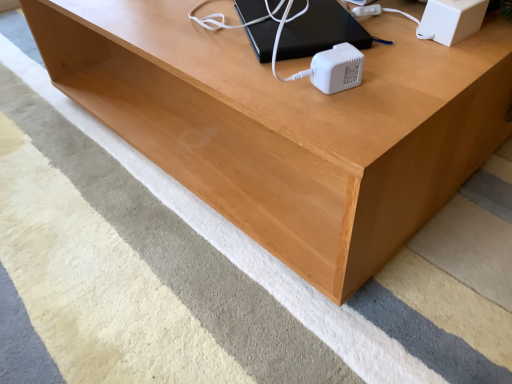
Question: Is black plastic computer at upper center bigger or smaller than white plastic speaker at upper right?

Choices:
 (A) small
 (B) big

Answer: (B)

Question: In terms of height, does black plastic computer at upper center look taller or shorter compared to white plastic speaker at upper right?

Choices:
 (A) tall
 (B) short

Answer: (B)

Question: Relative to white plastic speaker at upper right, is black plastic computer at upper center in front or behind?

Choices:
 (A) behind
 (B) front

Answer: (A)

Question: From a real-world perspective, relative to black plastic computer at upper center, is white plastic speaker at upper right vertically above or below?

Choices:
 (A) below
 (B) above

Answer: (B)

Question: Is white plastic speaker at upper right bigger or smaller than black plastic computer at upper center?

Choices:
 (A) small
 (B) big

Answer: (A)

Question: Considering the positions of white plastic speaker at upper right and black plastic computer at upper center in the image, is white plastic speaker at upper right wider or thinner than black plastic computer at upper center?

Choices:
 (A) wide
 (B) thin

Answer: (B)

Question: Considering their positions, is white plastic speaker at upper right located in front of or behind black plastic computer at upper center?

Choices:
 (A) behind
 (B) front

Answer: (B)